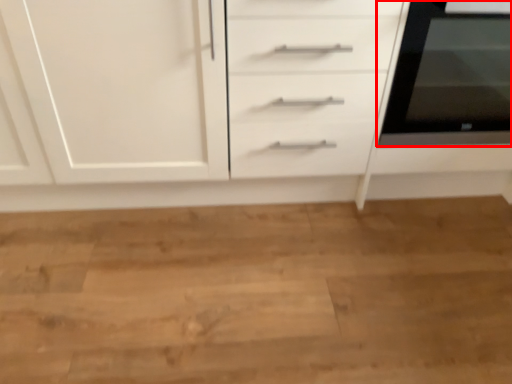
Question: Observing the image, what is the correct spatial positioning of home appliance (annotated by the red box) in reference to chest of drawers?

Choices:
 (A) right
 (B) left

Answer: (A)